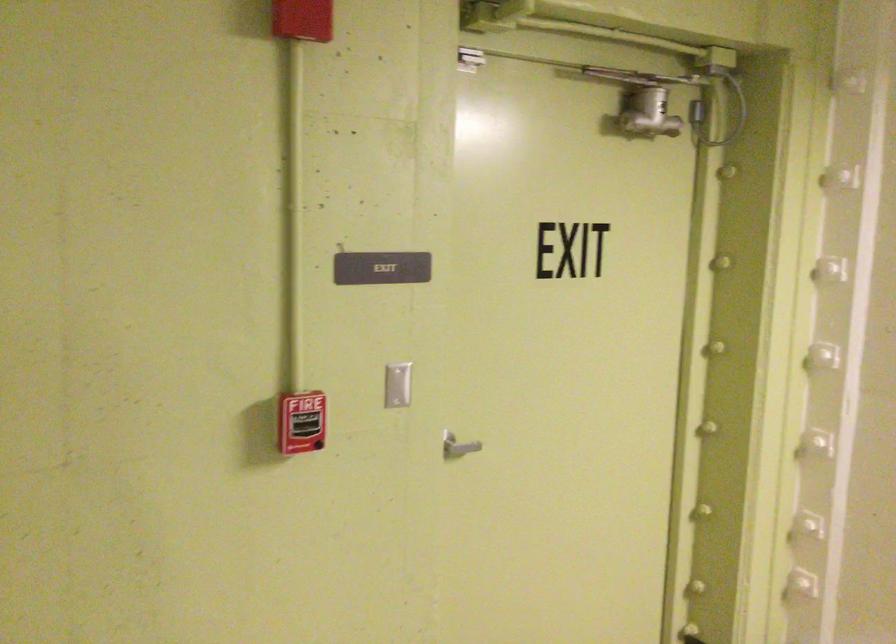
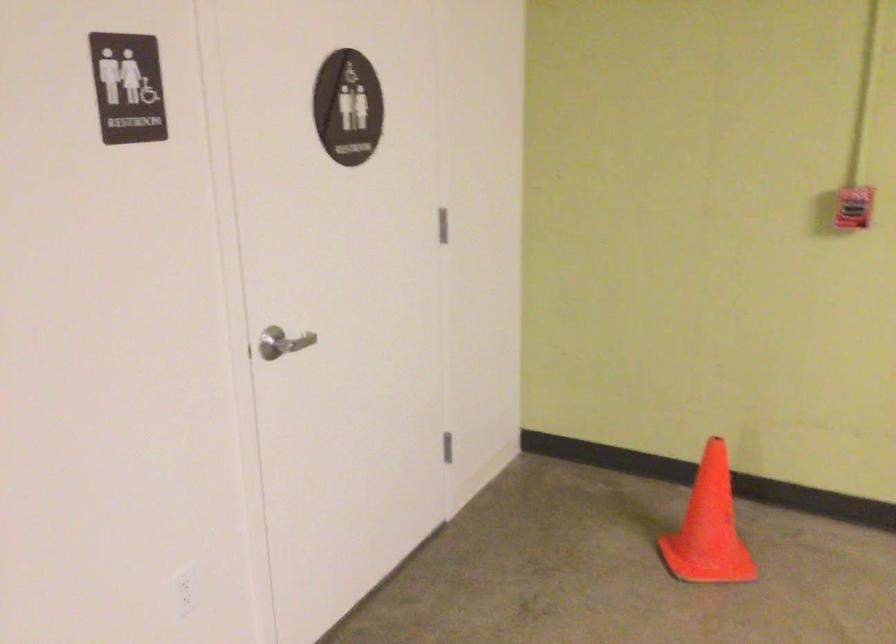
In the second image, find the point that corresponds to [297,402] in the first image.

(854, 207)